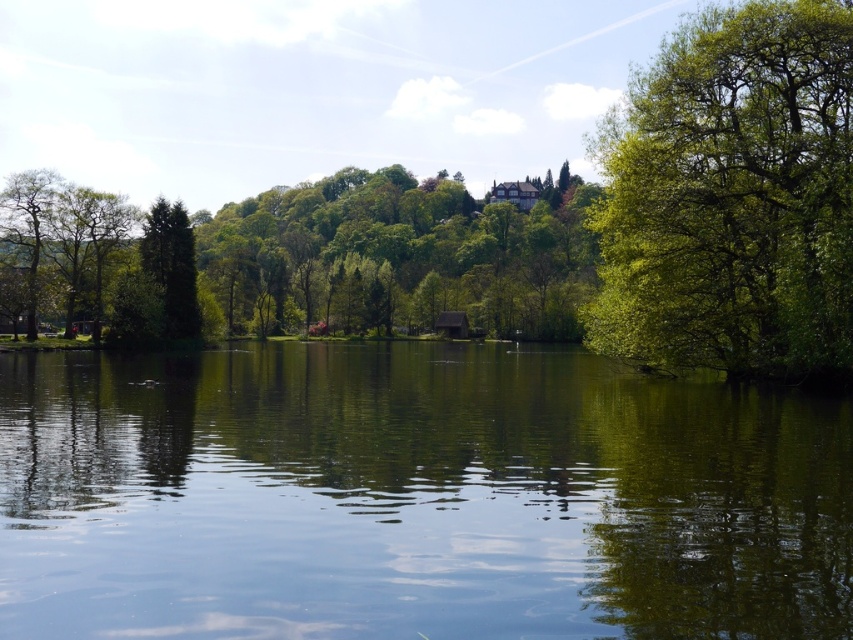
Where is `green leafy tree at right`? The height and width of the screenshot is (640, 853). green leafy tree at right is located at coordinates (x=732, y=196).

Does point (750, 204) come behind point (49, 192)?

No, it is not.

In order to click on green leafy tree at right in this screenshot , I will do `click(732, 196)`.

Does point (666, 518) come in front of point (630, 204)?

Yes, point (666, 518) is in front of point (630, 204).

How far apart are green reflective water at center and green leafy tree at right?

green reflective water at center is 14.47 meters away from green leafy tree at right.

Where is `green reflective water at center`? The height and width of the screenshot is (640, 853). green reflective water at center is located at coordinates (415, 497).

Is point (398, 369) positioned after point (39, 218)?

No, it is not.

Does green reflective water at center have a larger size compared to green leafy tree at left?

No, green reflective water at center is not bigger than green leafy tree at left.

What are the coordinates of `green reflective water at center` in the screenshot? It's located at (415, 497).

The height and width of the screenshot is (640, 853). I want to click on green reflective water at center, so click(x=415, y=497).